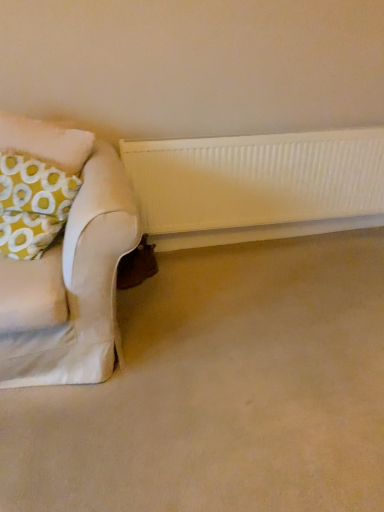
Question: From the image's perspective, relative to white ribbed radiator at center, is yellow fabric pillow at left above or below?

Choices:
 (A) below
 (B) above

Answer: (A)

Question: Which is correct: yellow fabric pillow at left is inside white ribbed radiator at center, or outside of it?

Choices:
 (A) outside
 (B) inside

Answer: (A)

Question: Which object is positioned closest to the beige carpet at lower center?

Choices:
 (A) yellow fabric pillow at left
 (B) white ribbed radiator at center
 (C) white textured radiator at lower center

Answer: (B)

Question: Which of these objects is positioned closest to the white ribbed radiator at center?

Choices:
 (A) beige carpet at lower center
 (B) yellow fabric pillow at left
 (C) white textured radiator at lower center

Answer: (C)